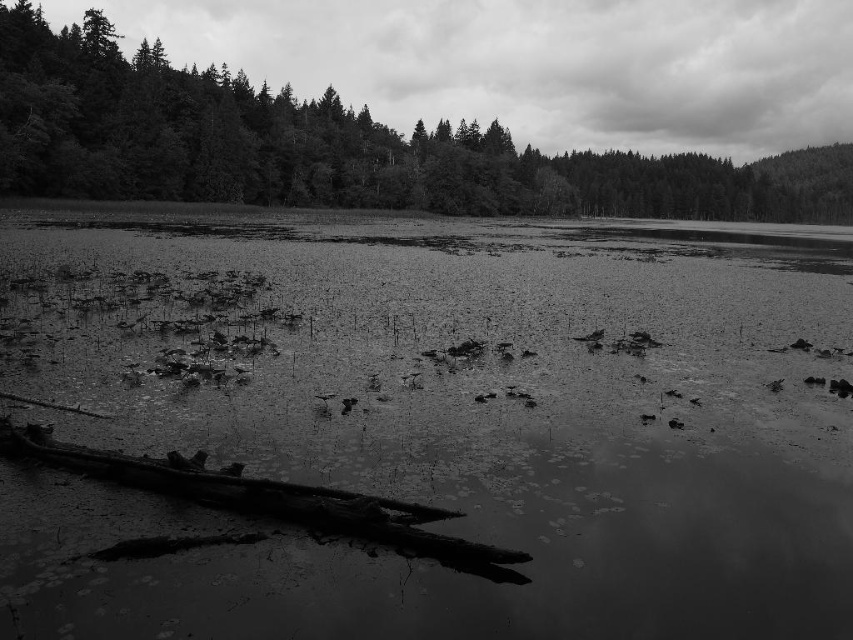
Question: Is translucent murky water at center to the left of smooth bark tree at center from the viewer's perspective?

Choices:
 (A) yes
 (B) no

Answer: (A)

Question: Can you confirm if translucent murky water at center is positioned to the right of smooth bark tree at center?

Choices:
 (A) no
 (B) yes

Answer: (A)

Question: Which of the following is the closest to the observer?

Choices:
 (A) (624, 208)
 (B) (345, 481)

Answer: (B)

Question: From the image, what is the correct spatial relationship of translucent murky water at center in relation to smooth bark tree at center?

Choices:
 (A) right
 (B) left

Answer: (B)

Question: Which of the following is the closest to the observer?

Choices:
 (A) (753, 385)
 (B) (259, 116)

Answer: (A)